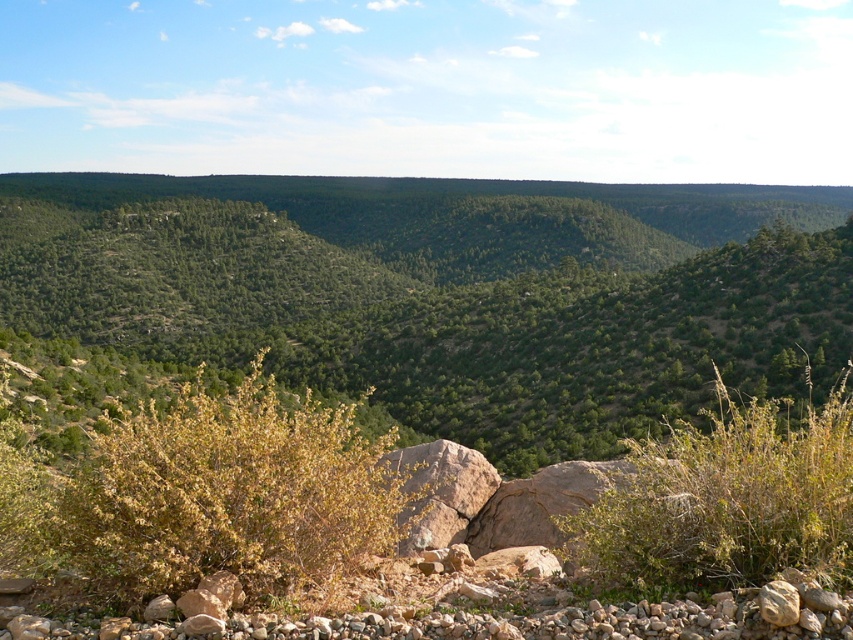
Question: Which of the following is the closest to the observer?

Choices:
 (A) (18, 548)
 (B) (590, 518)

Answer: (B)

Question: Can you confirm if brown dry bush at lower left is bigger than green leafy bush at center?

Choices:
 (A) no
 (B) yes

Answer: (B)

Question: Which point is farther to the camera?

Choices:
 (A) (635, 500)
 (B) (315, 440)

Answer: (B)

Question: Can you confirm if brown dry bush at lower left is positioned above green leafy bush at center?

Choices:
 (A) yes
 (B) no

Answer: (B)

Question: Which point appears farthest from the camera in this image?

Choices:
 (A) (608, 557)
 (B) (206, 515)

Answer: (A)

Question: Is brown dry bush at lower left smaller than green leafy bush at center?

Choices:
 (A) yes
 (B) no

Answer: (B)